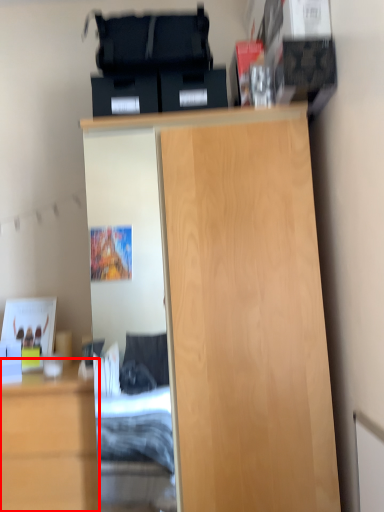
Question: From the image's perspective, what is the correct spatial positioning of cabinetry (annotated by the red box) in reference to cupboard?

Choices:
 (A) above
 (B) below

Answer: (B)